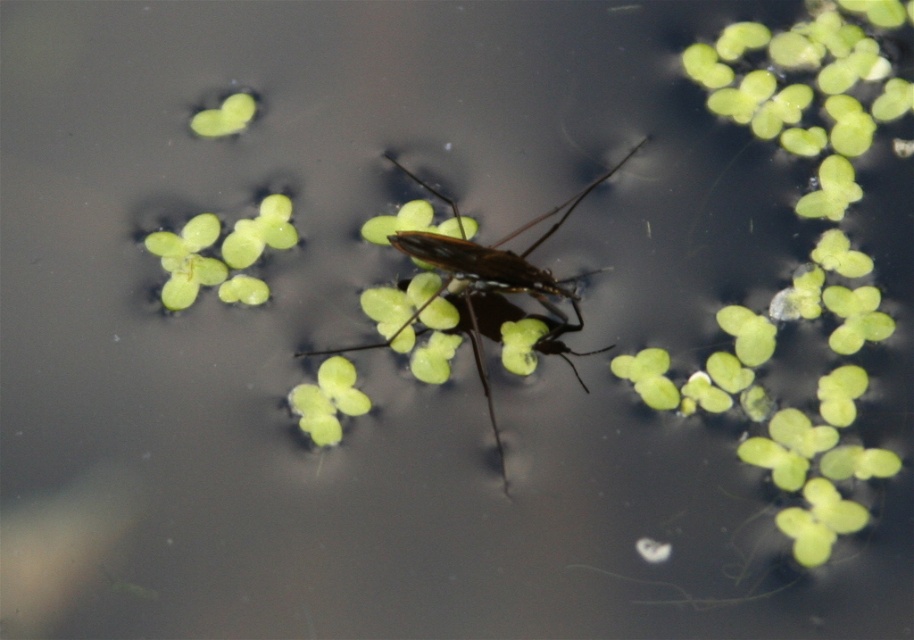
Which is behind, point (538, 241) or point (345, 396)?

Positioned behind is point (538, 241).

The width and height of the screenshot is (914, 640). I want to click on translucent brown insect at center, so click(x=491, y=282).

Does green leafy plant at upper left have a lesser height compared to green matte leaf at center?

In fact, green leafy plant at upper left may be taller than green matte leaf at center.

Consider the image. Between green leafy plant at upper left and green matte leaf at center, which one appears on the right side from the viewer's perspective?

Positioned to the right is green matte leaf at center.

Measure the distance between point (178, 292) and camera.

Point (178, 292) is 1.42 meters away from camera.

Where is `green leafy plant at upper left`? Image resolution: width=914 pixels, height=640 pixels. green leafy plant at upper left is located at coordinates (187, 259).

Between translucent brown insect at center and green leafy at upper left, which one appears on the right side from the viewer's perspective?

translucent brown insect at center is more to the right.

Is translucent brown insect at center wider than green leafy at upper left?

Yes, translucent brown insect at center is wider than green leafy at upper left.

The height and width of the screenshot is (640, 914). Identify the location of translucent brown insect at center. (491, 282).

This screenshot has height=640, width=914. I want to click on translucent brown insect at center, so (491, 282).